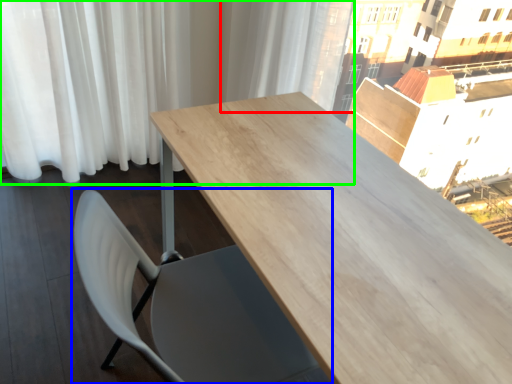
Question: Estimate the real-world distances between objects in this image. Which object is closer to curtain (highlighted by a red box), chair (highlighted by a blue box) or curtain (highlighted by a green box)?

Choices:
 (A) chair
 (B) curtain

Answer: (B)